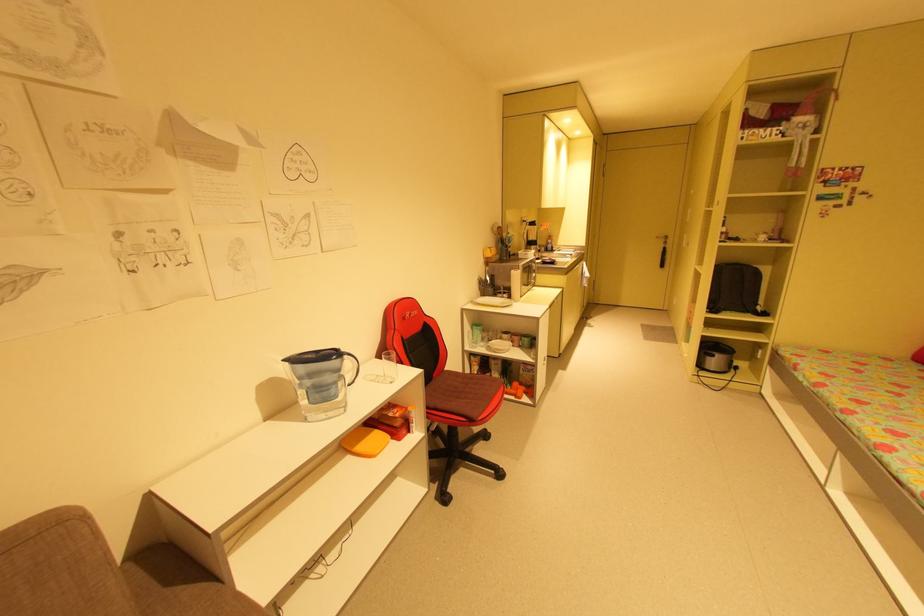
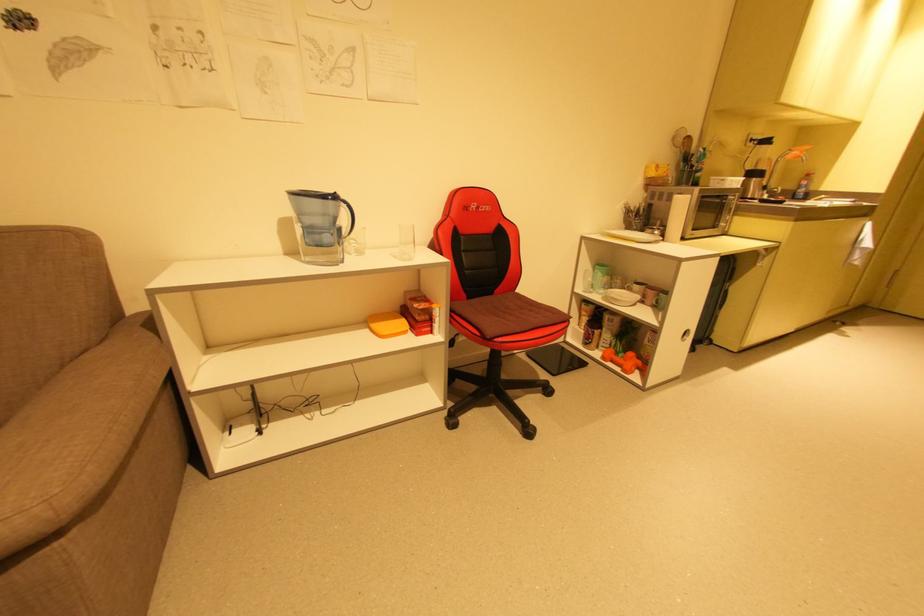
Where in the second image is the point corresponding to point (353, 458) from the first image?

(371, 331)